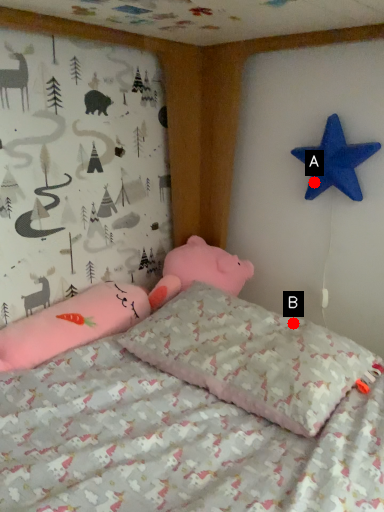
Question: Two points are circled on the image, labeled by A and B beside each circle. Which point is farther to the camera?

Choices:
 (A) A is further
 (B) B is further

Answer: (A)